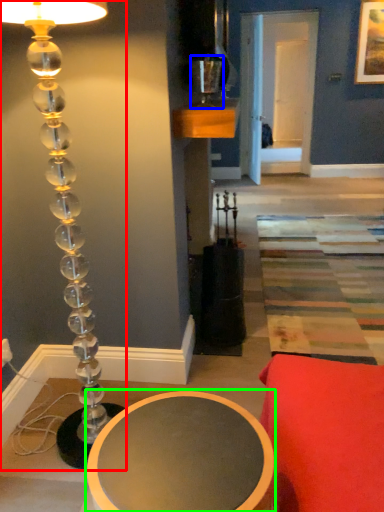
Question: Estimate the real-world distances between objects in this image. Which object is farther from lamp (highlighted by a red box), candle holder (highlighted by a blue box) or table (highlighted by a green box)?

Choices:
 (A) candle holder
 (B) table

Answer: (A)